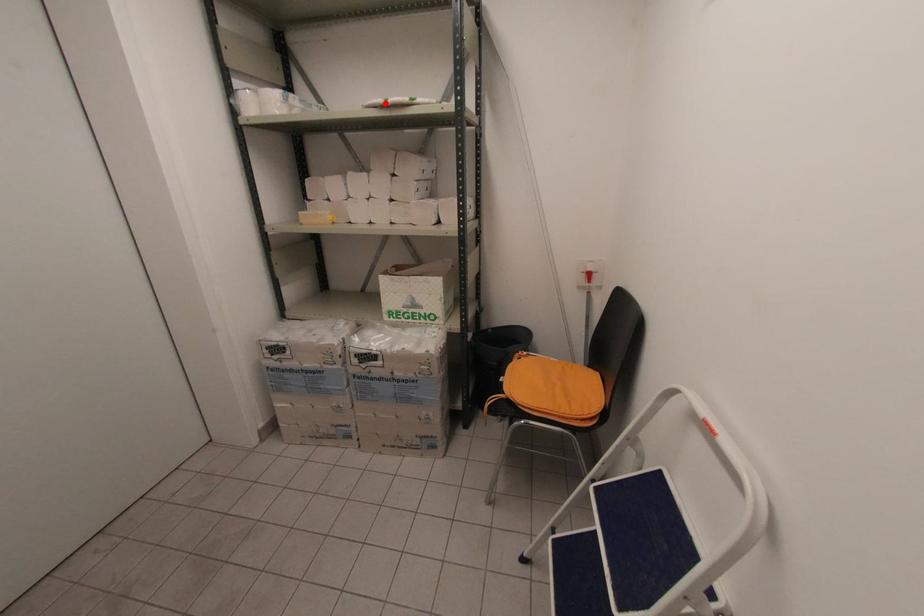
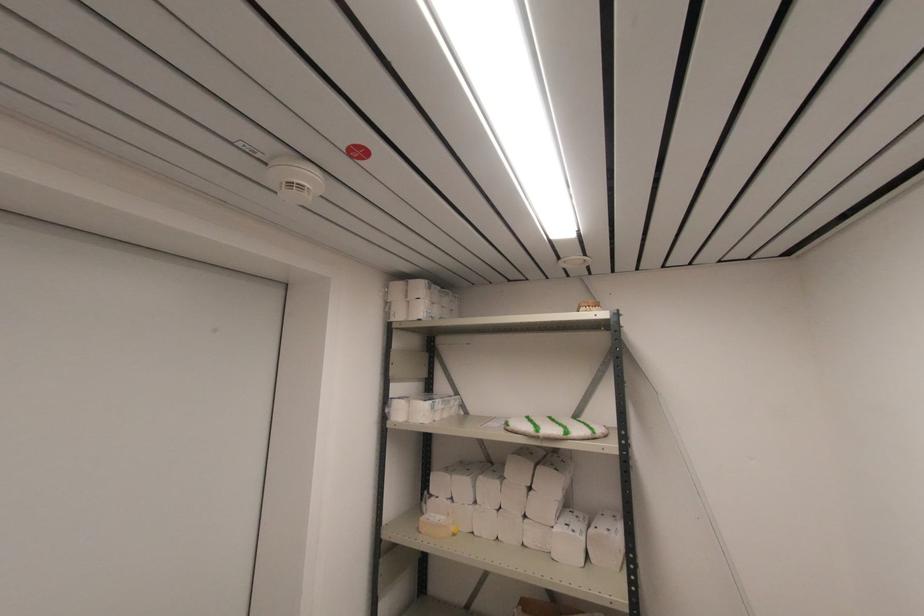
Find the pixel in the second image that matches the highlighted location in the first image.

(537, 436)